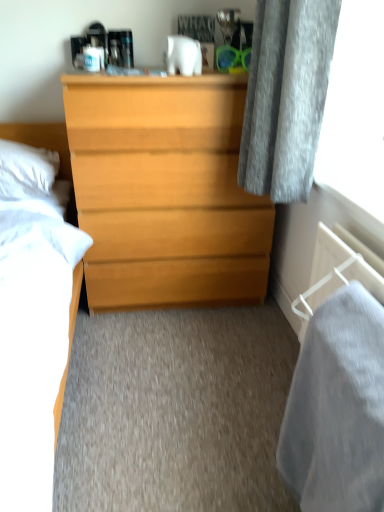
Question: Is gray soft fabric at lower right at the left side of white soft pillow at left?

Choices:
 (A) no
 (B) yes

Answer: (A)

Question: Does gray soft fabric at lower right have a greater width compared to white soft pillow at left?

Choices:
 (A) no
 (B) yes

Answer: (A)

Question: From a real-world perspective, is gray soft fabric at lower right on white soft pillow at left?

Choices:
 (A) no
 (B) yes

Answer: (A)

Question: Is gray soft fabric at lower right positioned in front of white soft pillow at left?

Choices:
 (A) yes
 (B) no

Answer: (A)

Question: From the image's perspective, does gray soft fabric at lower right appear higher than white soft pillow at left?

Choices:
 (A) yes
 (B) no

Answer: (B)

Question: Based on their positions, is gray soft fabric at lower right located to the left or right of light wood chest of drawers at center?

Choices:
 (A) left
 (B) right

Answer: (B)

Question: From a real-world perspective, is gray soft fabric at lower right positioned above or below light wood chest of drawers at center?

Choices:
 (A) below
 (B) above

Answer: (A)

Question: In terms of size, does gray soft fabric at lower right appear bigger or smaller than light wood chest of drawers at center?

Choices:
 (A) small
 (B) big

Answer: (A)

Question: Is gray soft fabric at lower right wider or thinner than light wood chest of drawers at center?

Choices:
 (A) wide
 (B) thin

Answer: (B)

Question: Looking at their shapes, would you say white soft pillow at left is wider or thinner than light wood chest of drawers at center?

Choices:
 (A) thin
 (B) wide

Answer: (A)

Question: Is white soft pillow at left situated inside light wood chest of drawers at center or outside?

Choices:
 (A) outside
 (B) inside

Answer: (A)

Question: From the image's perspective, is white soft pillow at left located above or below light wood chest of drawers at center?

Choices:
 (A) below
 (B) above

Answer: (B)

Question: Is point (13, 157) closer or farther from the camera than point (220, 257)?

Choices:
 (A) closer
 (B) farther

Answer: (A)

Question: Is point (238, 285) closer or farther from the camera than point (33, 170)?

Choices:
 (A) closer
 (B) farther

Answer: (B)

Question: From a real-world perspective, is light wood chest of drawers at center positioned above or below white soft pillow at left?

Choices:
 (A) below
 (B) above

Answer: (A)